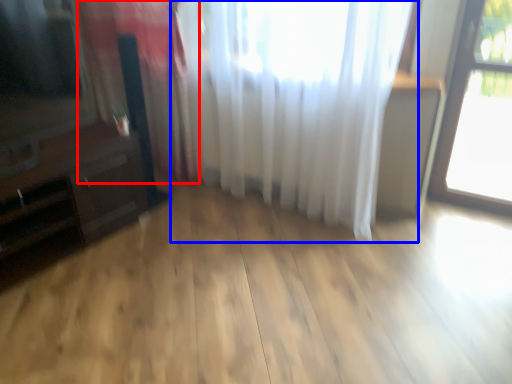
Question: Which object is further to the camera taking this photo, curtain (highlighted by a red box) or curtain (highlighted by a blue box)?

Choices:
 (A) curtain
 (B) curtain

Answer: (A)